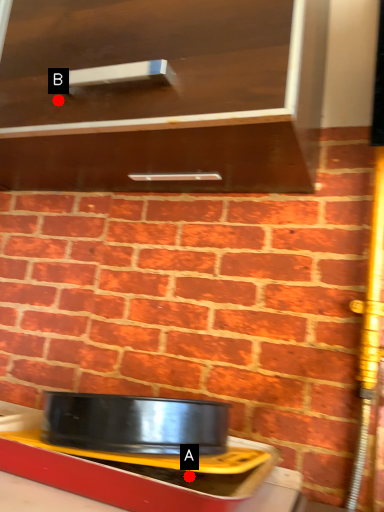
Question: Two points are circled on the image, labeled by A and B beside each circle. Which point is farther to the camera?

Choices:
 (A) A is further
 (B) B is further

Answer: (B)